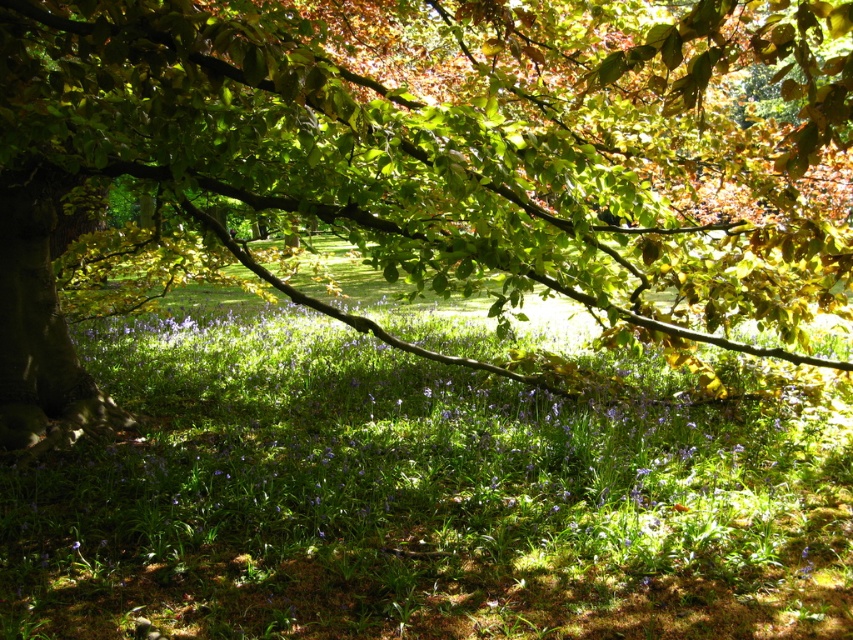
Question: Does green leafy tree at upper left appear over green leafy grass at center?

Choices:
 (A) yes
 (B) no

Answer: (A)

Question: Which of the following is the closest to the observer?

Choices:
 (A) (496, 413)
 (B) (24, 48)

Answer: (B)

Question: Which point is farther to the camera?

Choices:
 (A) (218, 314)
 (B) (480, 157)

Answer: (A)

Question: Can you confirm if green leafy tree at upper left is positioned below green leafy grass at center?

Choices:
 (A) yes
 (B) no

Answer: (B)

Question: Among these objects, which one is nearest to the camera?

Choices:
 (A) green leafy grass at center
 (B) green leafy tree at upper left

Answer: (B)

Question: Observing the image, what is the correct spatial positioning of green leafy tree at upper left in reference to green leafy grass at center?

Choices:
 (A) above
 (B) below

Answer: (A)